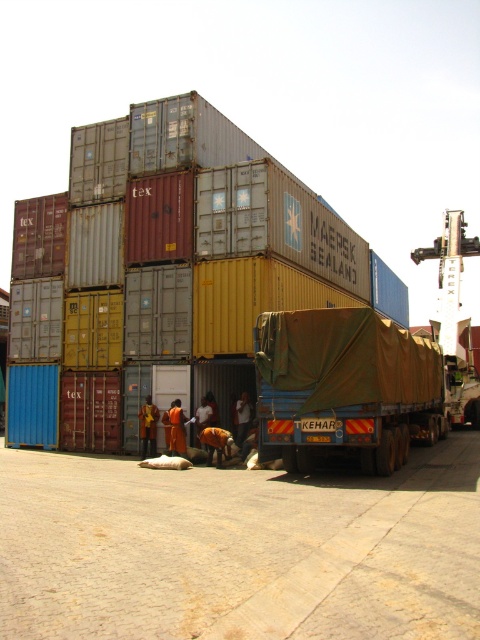
You are a crane operator trying to lift a container from the shipping yard. You see two points marked in the scene. The first point is at coordinate point (241, 268) and the second is at point (354, 417). From your position, which point is closer to you?

Point (354, 417) is closer to you because it is in front of point (241, 268) according to the spatial relationship provided.

You are a delivery person who needs to secure a large shipment. You have a camouflage fabric tarpaulin at center and a brown canvas trailer truck at center. Which item is wider to cover the shipment properly?

The camouflage fabric tarpaulin at center might be wider than brown canvas trailer truck at center, so it is more suitable to cover the shipment properly.

You are a delivery driver who needs to secure a large shipment. You have a camouflage fabric tarpaulin at center and a brown canvas trailer truck at center. Which object should you use to cover your cargo if you need a larger covering?

The camouflage fabric tarpaulin at center is larger in size than the brown canvas trailer truck at center, so you should use the camouflage fabric tarpaulin at center to cover your cargo.